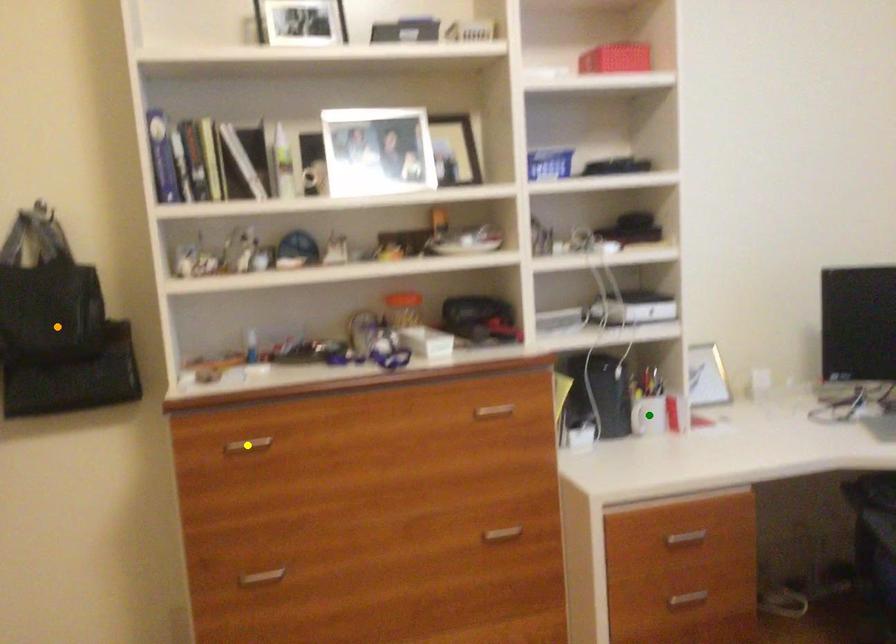
Order these from nearest to farthest:
yellow point, orange point, green point

yellow point
orange point
green point